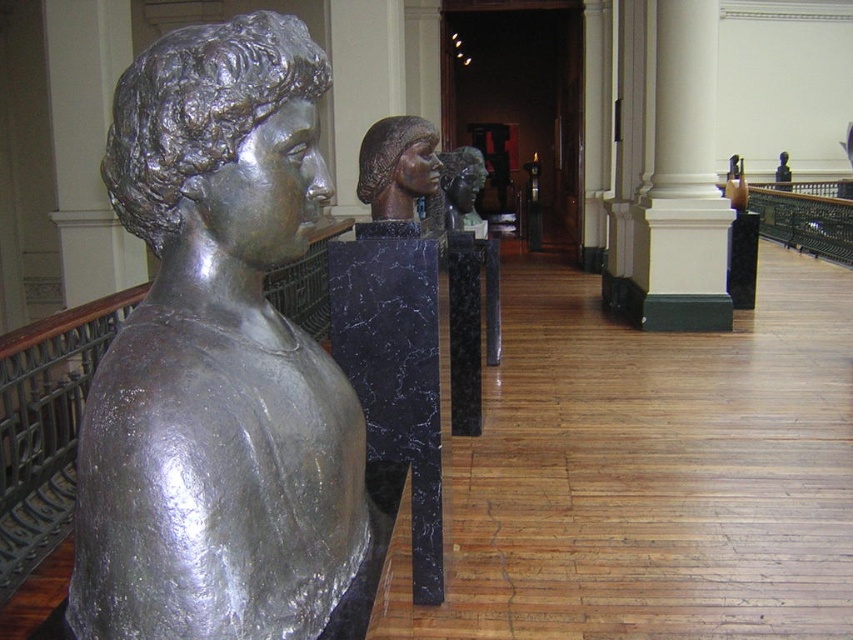
Question: Which object is farther from the camera taking this photo?

Choices:
 (A) polished bronze bust at center
 (B) bronze sculpture at center

Answer: (A)

Question: Which object is positioned closest to the polished bronze bust at center?

Choices:
 (A) shiny silver bust at left
 (B) bronze sculpture at center

Answer: (B)

Question: Can you confirm if shiny silver bust at left is positioned below polished bronze bust at center?

Choices:
 (A) yes
 (B) no

Answer: (A)

Question: Does shiny silver bust at left have a smaller size compared to polished bronze bust at center?

Choices:
 (A) yes
 (B) no

Answer: (B)

Question: Which of these objects is positioned farthest from the bronze sculpture at center?

Choices:
 (A) polished bronze bust at center
 (B) shiny silver bust at left

Answer: (A)

Question: Does bronze sculpture at center have a lesser width compared to polished bronze bust at center?

Choices:
 (A) yes
 (B) no

Answer: (B)